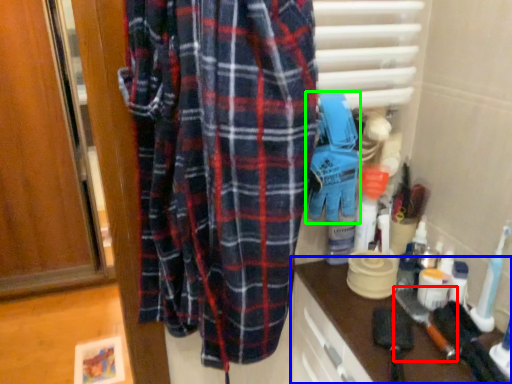
Question: Which object is positioned farthest from brush (highlighted by a red box)? Select from counter (highlighted by a blue box) and toy (highlighted by a green box).

Choices:
 (A) counter
 (B) toy

Answer: (B)